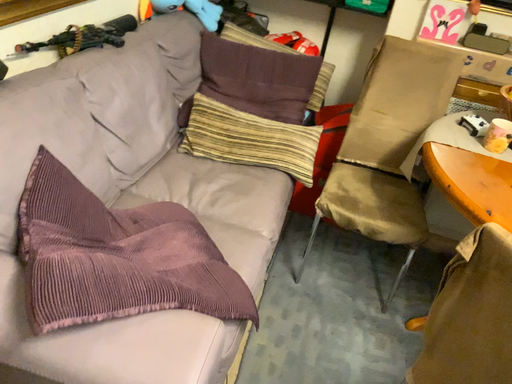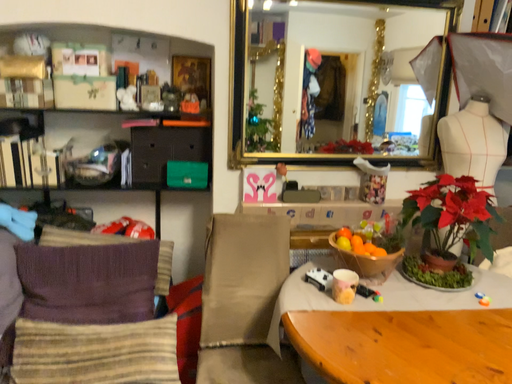
Question: How did the camera likely rotate when shooting the video?

Choices:
 (A) rotated right
 (B) rotated left

Answer: (A)